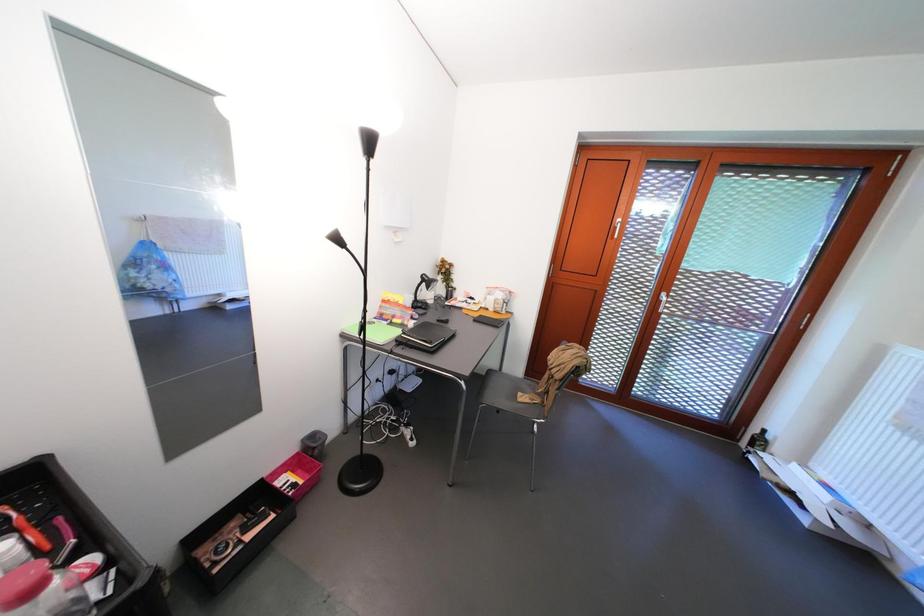
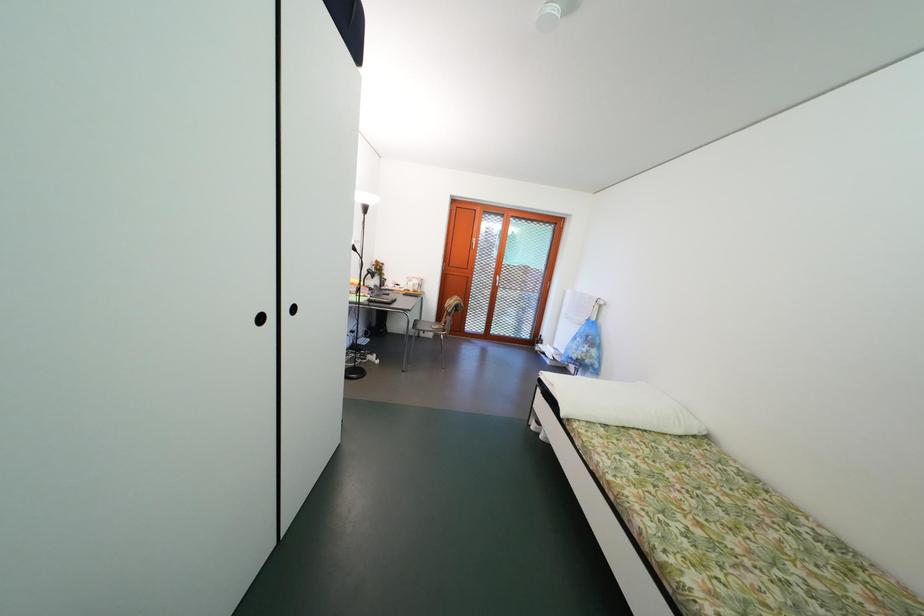
Question: What movement of the cameraman would produce the second image?

Choices:
 (A) Left
 (B) Right
 (C) Forward
 (D) Backward

Answer: (D)